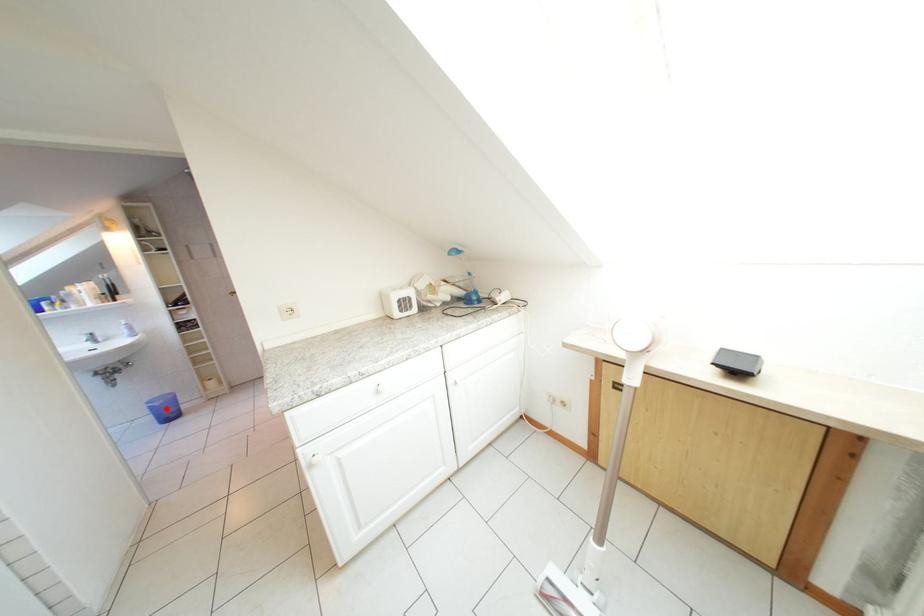
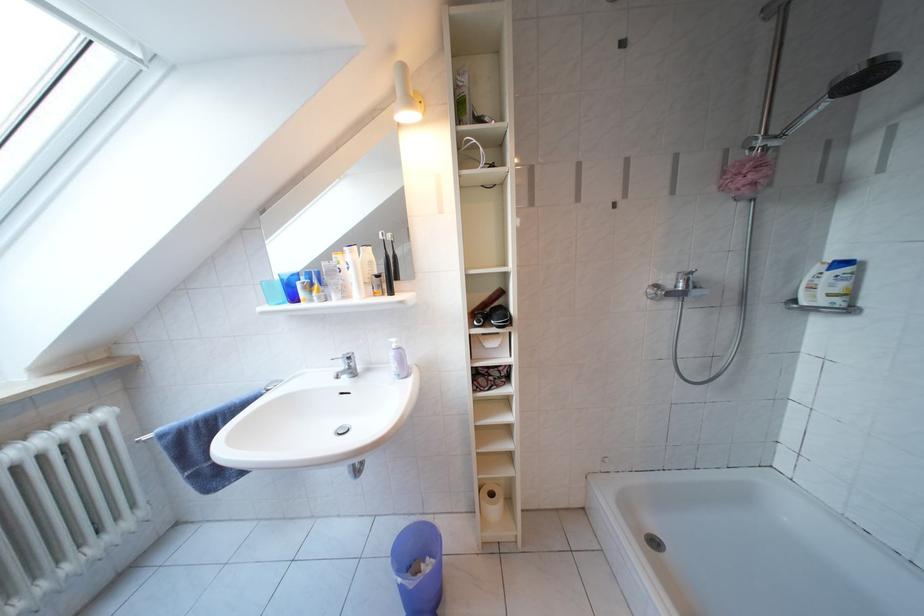
Question: I am providing you with two images of the same scene from different viewpoints. In image1, a red point is highlighted. Considering the same 3D point in image2, which of the following is correct?

Choices:
 (A) It is closer
 (B) It is farther

Answer: (A)